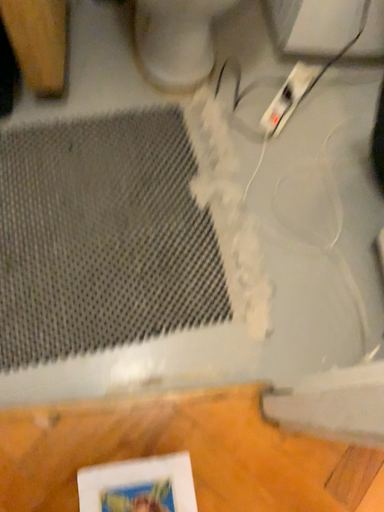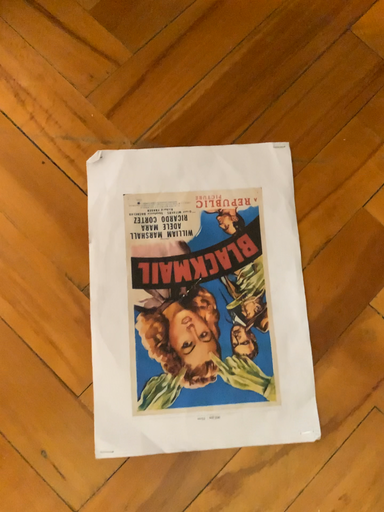
Question: Which way did the camera rotate in the video?

Choices:
 (A) rotated upward
 (B) rotated downward

Answer: (A)